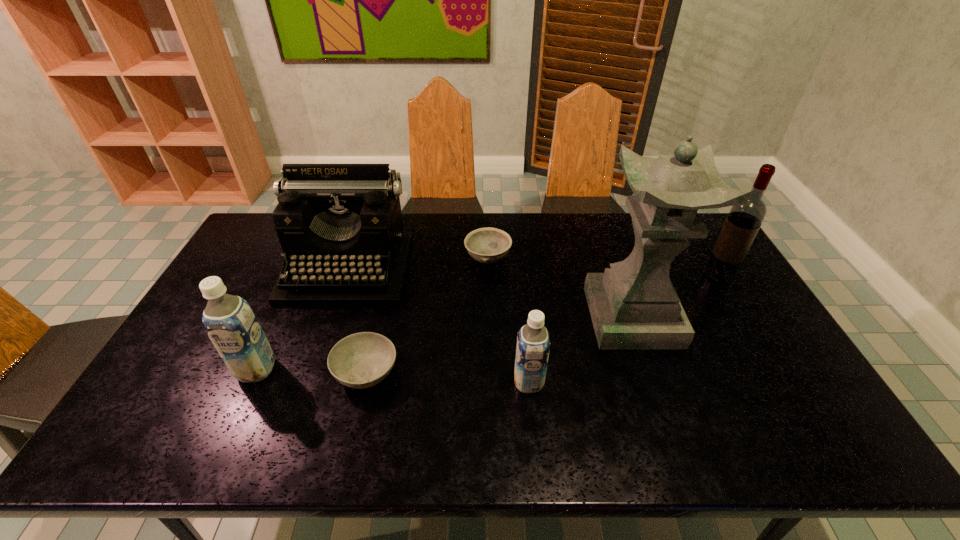
Please point a free position for a soya milk on the right. Please provide its 2D coordinates. Your answer should be formatted as a tuple, i.e. [(x, y)], where the tuple contains the x and y coordinates of a point satisfying the conditions above.

[(815, 395)]